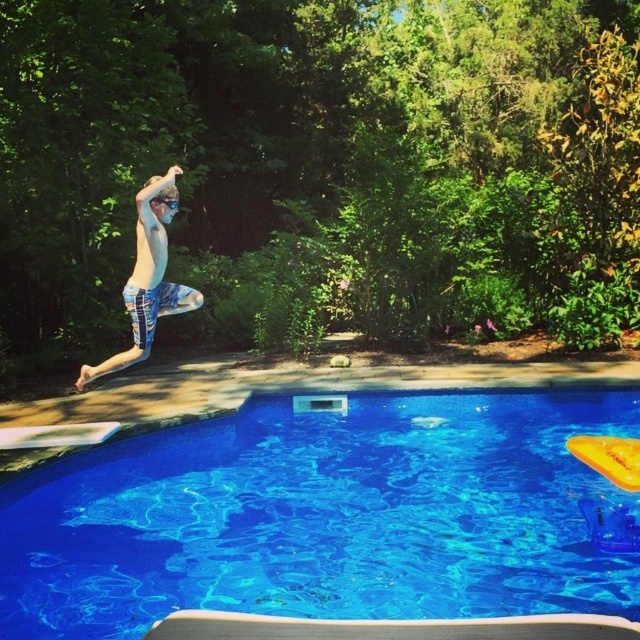
Question: Is blue glossy water at center positioned at the back of black plastic goggles at upper center?

Choices:
 (A) no
 (B) yes

Answer: (A)

Question: Does blue printed shorts at center have a smaller size compared to black plastic goggles at upper center?

Choices:
 (A) yes
 (B) no

Answer: (B)

Question: Which point is closer to the camera taking this photo?

Choices:
 (A) (172, 202)
 (B) (161, 588)

Answer: (B)

Question: Which point appears closest to the camera in this image?

Choices:
 (A) (160, 195)
 (B) (104, 372)
 (C) (550, 596)

Answer: (C)

Question: Considering the relative positions of blue glossy water at center and black plastic goggles at upper center in the image provided, where is blue glossy water at center located with respect to black plastic goggles at upper center?

Choices:
 (A) above
 (B) below

Answer: (B)

Question: Which is farther from the black plastic goggles at upper center?

Choices:
 (A) blue glossy water at center
 (B) blue printed shorts at center

Answer: (A)